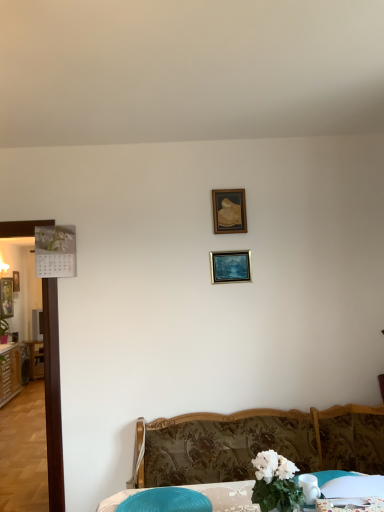
Question: Can you confirm if blue plastic swivel chair at lower center is positioned to the left of green leafy plant at left?

Choices:
 (A) yes
 (B) no

Answer: (B)

Question: Does blue plastic swivel chair at lower center appear on the right side of green leafy plant at left?

Choices:
 (A) yes
 (B) no

Answer: (A)

Question: Is blue plastic swivel chair at lower center positioned far away from green leafy plant at left?

Choices:
 (A) no
 (B) yes

Answer: (B)

Question: Does blue plastic swivel chair at lower center have a lesser width compared to green leafy plant at left?

Choices:
 (A) no
 (B) yes

Answer: (A)

Question: Is blue plastic swivel chair at lower center directly adjacent to green leafy plant at left?

Choices:
 (A) yes
 (B) no

Answer: (B)

Question: Is wooden picture frame at upper center, which ranks as the 4th picture frame in left-to-right order, situated inside green leafy plant at left or outside?

Choices:
 (A) outside
 (B) inside

Answer: (A)

Question: Considering the positions of point 213,221 and point 3,326, is point 213,221 closer or farther from the camera than point 3,326?

Choices:
 (A) farther
 (B) closer

Answer: (B)

Question: Based on their sizes in the image, would you say wooden picture frame at upper center, which appears as the 2th picture frame when viewed from the front, is bigger or smaller than green leafy plant at left?

Choices:
 (A) big
 (B) small

Answer: (B)

Question: Is wooden picture frame at upper center, which appears as the 2th picture frame when viewed from the front, in front of or behind green leafy plant at left in the image?

Choices:
 (A) front
 (B) behind

Answer: (A)

Question: Is wooden picture frame at upper center, which ranks as the 4th picture frame in left-to-right order, in front of or behind metallic silver picture frame at center, the fourth picture frame from the back, in the image?

Choices:
 (A) front
 (B) behind

Answer: (B)

Question: In terms of height, does wooden picture frame at upper center, the 3th picture frame in the back-to-front sequence, look taller or shorter compared to metallic silver picture frame at center, which is the 2th picture frame in right-to-left order?

Choices:
 (A) tall
 (B) short

Answer: (A)

Question: From the image's perspective, relative to metallic silver picture frame at center, the fourth picture frame from the back, is wooden picture frame at upper center, the 3th picture frame in the back-to-front sequence, above or below?

Choices:
 (A) below
 (B) above

Answer: (B)

Question: Based on their positions, is wooden picture frame at upper center, which appears as the 2th picture frame when viewed from the front, located to the left or right of metallic silver picture frame at center, the 3th picture frame when ordered from left to right?

Choices:
 (A) right
 (B) left

Answer: (A)

Question: Considering the positions of metallic silver picture frame at left, which is the third picture frame in front-to-back order, and metallic calendar at left, which is counted as the third picture frame, starting from the top, in the image, is metallic silver picture frame at left, which is the third picture frame in front-to-back order, taller or shorter than metallic calendar at left, which is counted as the third picture frame, starting from the top,?

Choices:
 (A) tall
 (B) short

Answer: (A)

Question: From a real-world perspective, relative to metallic calendar at left, which is the 1th picture frame in back-to-front order, is metallic silver picture frame at left, the third picture frame from the right, vertically above or below?

Choices:
 (A) below
 (B) above

Answer: (A)